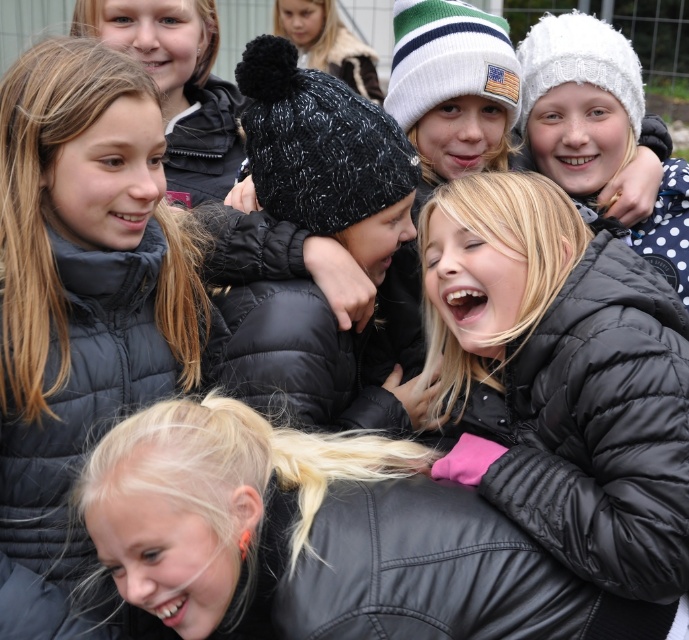
You are a photographer trying to capture a clear shot of the black quilted jacket at lower right and the black fuzzy beanie at upper center. Since the jacket is blocking the view of the beanie, which object should you adjust your focus to ensure the beanie is visible?

The black quilted jacket at lower right is in front of the black fuzzy beanie at upper center, so you should focus on the black fuzzy beanie at upper center to ensure it is visible by moving the camera angle or adjusting the position to avoid obstruction.

You are a photographer trying to capture a clear shot of the black quilted jacket at lower right and the black puffer jacket at center. Which jacket should you focus on first to ensure it appears sharp in the photo without needing to adjust your focus afterward?

You should focus on the black quilted jacket at lower right first because it is in front of the black puffer jacket at center, so once focused, it will remain sharp without needing to adjust focus for the jacket behind it.

Based on the scene description, where is the black quilted jacket at lower right located in relation to the black fuzzy beanie at upper center?

The black quilted jacket at lower right is to the right of the black fuzzy beanie at upper center.